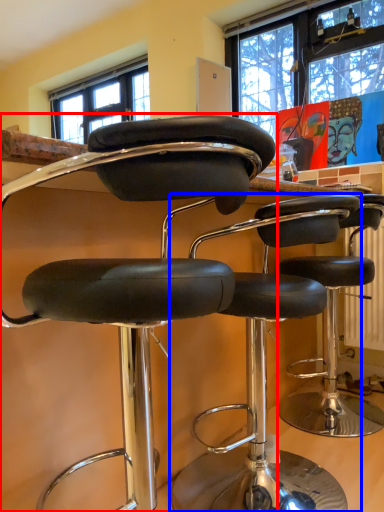
Question: Which object is closer to the camera taking this photo, chair (highlighted by a red box) or chair (highlighted by a blue box)?

Choices:
 (A) chair
 (B) chair

Answer: (A)